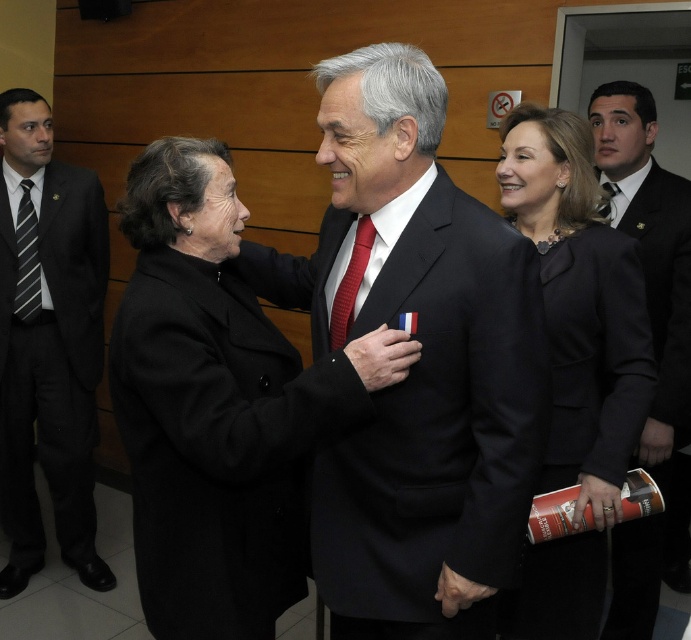
Based on the photo, is black suit at left shorter than matte red tie at center?

No, black suit at left is not shorter than matte red tie at center.

Between point (19, 477) and point (612, 202), which one is positioned in front?

Point (612, 202) is more forward.

The height and width of the screenshot is (640, 691). What do you see at coordinates (47, 342) in the screenshot?
I see `black suit at left` at bounding box center [47, 342].

This screenshot has width=691, height=640. Find the location of `black suit at left`. black suit at left is located at coordinates (47, 342).

Who is shorter, black wool coat at center or matte red tie at center?

Standing shorter between the two is matte red tie at center.

Is black wool coat at center wider than matte red tie at center?

Correct, the width of black wool coat at center exceeds that of matte red tie at center.

Does point (274, 332) come behind point (614, 192)?

No, (274, 332) is closer to viewer.

You are a GUI agent. You are given a task and a screenshot of the screen. Output one action in this format:
    pyautogui.click(x=<x>, y=<y>)
    Task: Click on the black wool coat at center
    Image resolution: width=691 pixels, height=640 pixels.
    Given the screenshot: What is the action you would take?
    pyautogui.click(x=211, y=408)

Is black wool coat at center above black satin dress at center?

No, black wool coat at center is not above black satin dress at center.

Who is positioned more to the left, black wool coat at center or black satin dress at center?

From the viewer's perspective, black wool coat at center appears more on the left side.

Measure the distance between black wool coat at center and camera.

A distance of 1.19 meters exists between black wool coat at center and camera.

Locate an element on the screen. black wool coat at center is located at coordinates (211, 408).